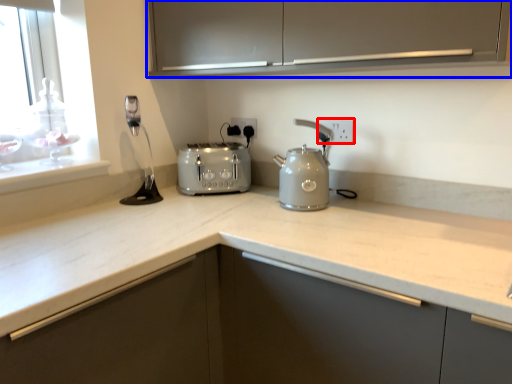
Question: Which of the following is the closest to the observer, electric outlet (highlighted by a red box) or cabinetry (highlighted by a blue box)?

Choices:
 (A) electric outlet
 (B) cabinetry

Answer: (B)